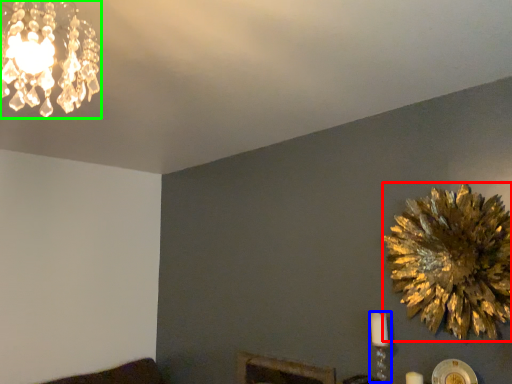
Question: Considering the real-world distances, which object is farthest from flower (highlighted by a red box)? candle holder (highlighted by a blue box) or lamp (highlighted by a green box)?

Choices:
 (A) candle holder
 (B) lamp

Answer: (B)